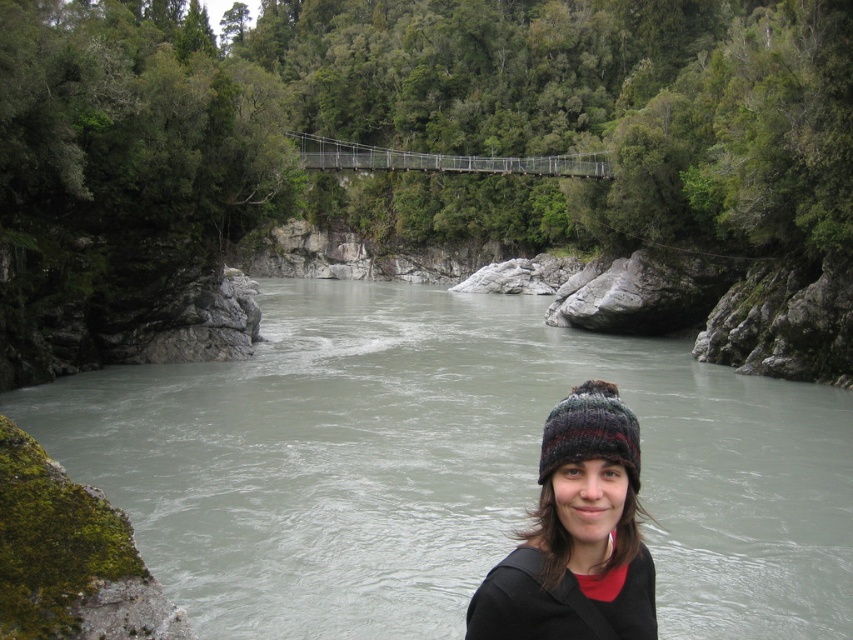
Who is positioned more to the left, black knitted hat at center or metallic wire suspension bridge at center?

metallic wire suspension bridge at center

Who is lower down, black knitted hat at center or metallic wire suspension bridge at center?

black knitted hat at center is lower down.

Locate an element on the screen. The image size is (853, 640). black knitted hat at center is located at coordinates (576, 536).

Image resolution: width=853 pixels, height=640 pixels. I want to click on gray smooth water at center, so click(447, 467).

Can you confirm if gray smooth water at center is thinner than black knitted hat at center?

Incorrect, gray smooth water at center's width is not less than black knitted hat at center's.

Is point (802, 442) behind point (564, 401)?

That is True.

Locate an element on the screen. Image resolution: width=853 pixels, height=640 pixels. gray smooth water at center is located at coordinates (447, 467).

Does point (302, 554) come closer to viewer compared to point (339, 161)?

Yes, it is in front of point (339, 161).

Does point (477, 308) come farther from viewer compared to point (321, 140)?

No, it is not.

This screenshot has height=640, width=853. Find the location of `gray smooth water at center`. gray smooth water at center is located at coordinates (447, 467).